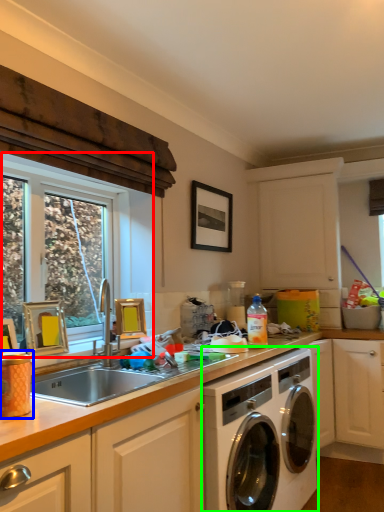
Question: Considering the real-world distances, which object is closest to window (highlighted by a red box)? appliance (highlighted by a blue box) or washing machine (highlighted by a green box).

Choices:
 (A) appliance
 (B) washing machine

Answer: (B)